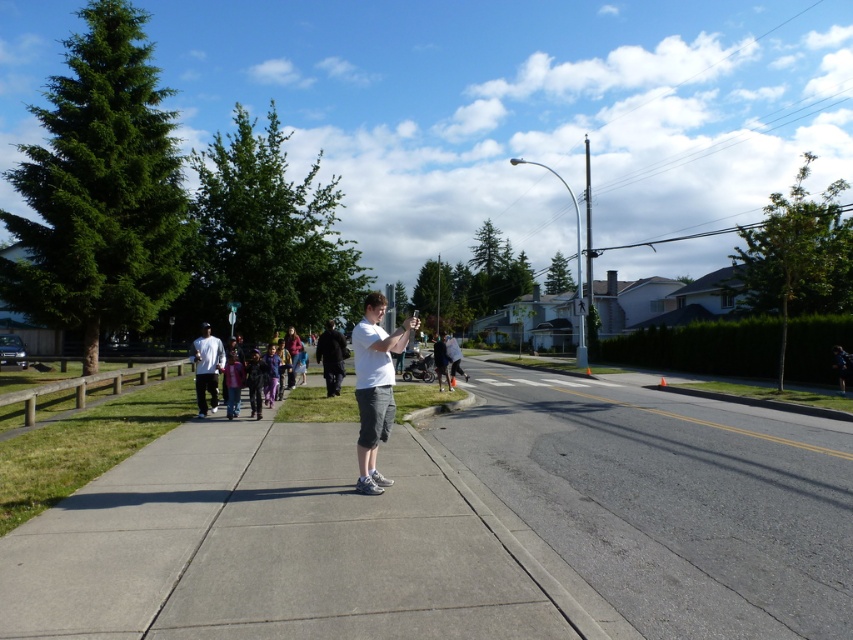
You are a pedestrian standing on the sidewalk. You see the gray asphalt road at center and the white matte shirt at center. Which object is closer to the ground?

The gray asphalt road at center is located below the white matte shirt at center, so it is closer to the ground.

You are a fashion designer observing a group of people on a sidewalk. You notice two individuals wearing white shirts at the center of the scene. Which shirt has a wider width, the white cotton shirt at center or the white matte shirt at center?

The white matte shirt at center has a wider width than the white cotton shirt at center according to the description.